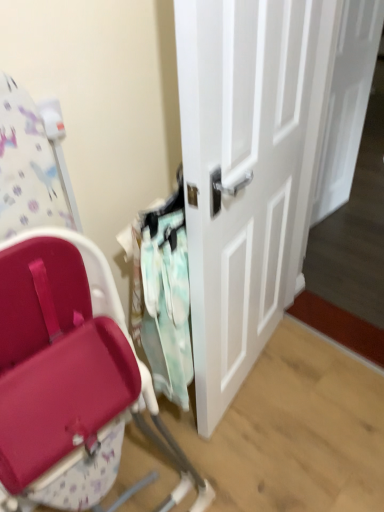
At what (x,y) coordinates should I click in order to perform the action: click on spots to the right of white glossy door at center, arranged as the first door when viewed from the front. Please return your answer as a coordinate pair (x, y). The image size is (384, 512). Looking at the image, I should click on (320, 372).